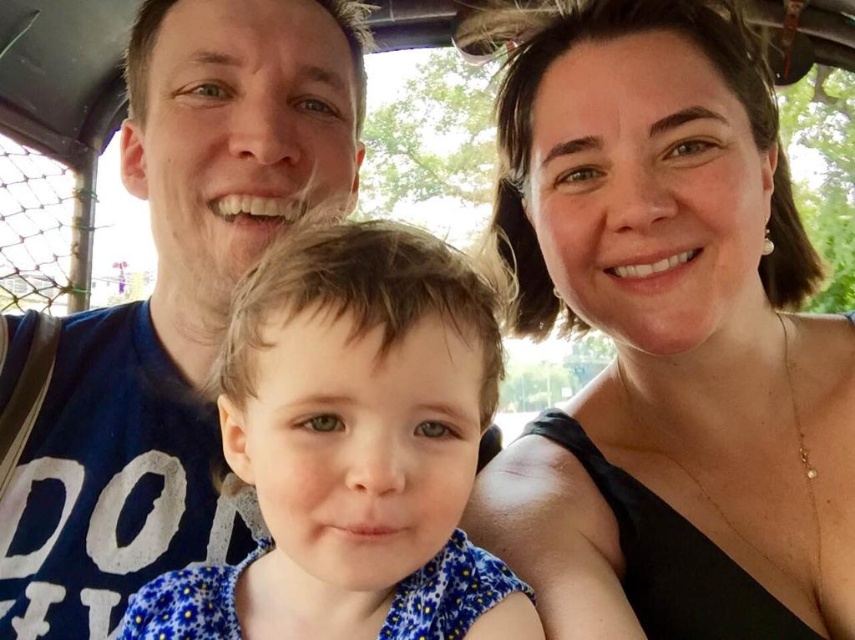
Question: Which object is the closest to the matte black top at upper right?

Choices:
 (A) blue cotton shirt at left
 (B) blue floral dress at center

Answer: (B)

Question: Is the position of blue cotton shirt at left less distant than that of blue floral dress at center?

Choices:
 (A) no
 (B) yes

Answer: (A)

Question: Which point appears farthest from the camera in this image?

Choices:
 (A) (423, 296)
 (B) (152, 298)

Answer: (B)

Question: In this image, where is blue cotton shirt at left located relative to blue floral dress at center?

Choices:
 (A) above
 (B) below

Answer: (A)

Question: Is matte black top at upper right smaller than blue cotton shirt at left?

Choices:
 (A) no
 (B) yes

Answer: (A)

Question: Which point is closer to the camera taking this photo?

Choices:
 (A) (775, 392)
 (B) (420, 435)
 (C) (81, 596)

Answer: (B)